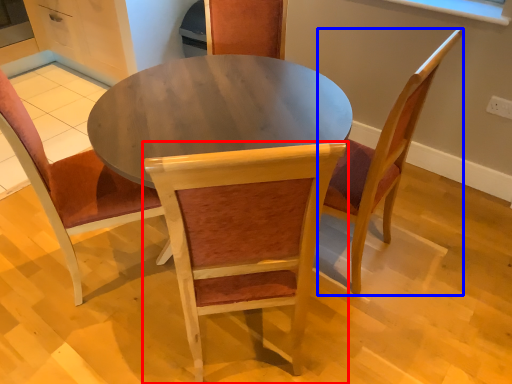
Question: Which of the following is the closest to the observer, chair (highlighted by a red box) or chair (highlighted by a blue box)?

Choices:
 (A) chair
 (B) chair

Answer: (A)